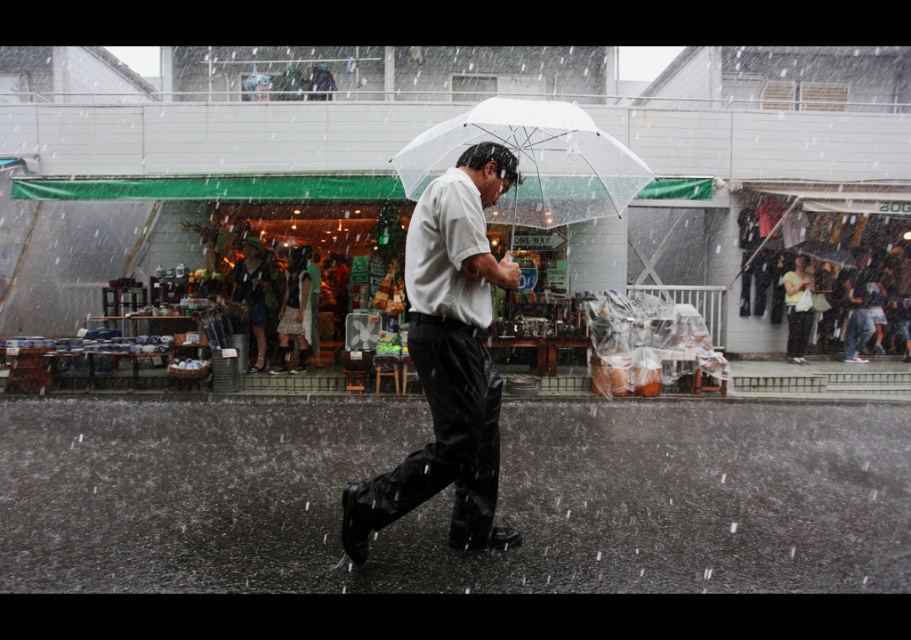
Question: Can you confirm if white matte umbrella at center is positioned to the left of transparent plastic umbrella at center?

Choices:
 (A) yes
 (B) no

Answer: (A)

Question: Does white matte umbrella at center appear over transparent plastic umbrella at center?

Choices:
 (A) no
 (B) yes

Answer: (A)

Question: Among these points, which one is nearest to the camera?

Choices:
 (A) (474, 416)
 (B) (510, 124)

Answer: (B)

Question: Is white matte umbrella at center smaller than transparent plastic umbrella at center?

Choices:
 (A) no
 (B) yes

Answer: (A)

Question: Which of the following is the farthest from the observer?

Choices:
 (A) transparent plastic umbrella at center
 (B) white matte umbrella at center

Answer: (A)